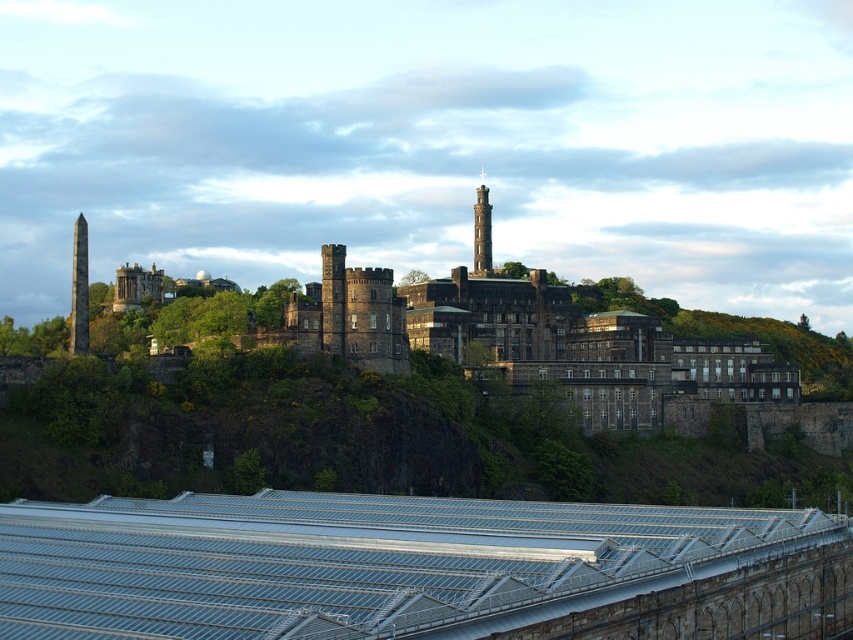
Question: Which object is the closest to the smooth stone chimney at center?

Choices:
 (A) metallic gray roof at lower center
 (B) brown stone obelisk at left

Answer: (B)

Question: Based on their relative distances, which object is nearer to the metallic gray roof at lower center?

Choices:
 (A) brown stone obelisk at left
 (B) smooth stone chimney at center

Answer: (A)

Question: Which point appears farthest from the camera in this image?

Choices:
 (A) (196, 506)
 (B) (80, 308)

Answer: (B)

Question: Is metallic gray roof at lower center to the left of smooth stone chimney at center from the viewer's perspective?

Choices:
 (A) yes
 (B) no

Answer: (A)

Question: Does brown stone obelisk at left appear over smooth stone chimney at center?

Choices:
 (A) yes
 (B) no

Answer: (B)

Question: Does metallic gray roof at lower center have a greater width compared to smooth stone chimney at center?

Choices:
 (A) no
 (B) yes

Answer: (B)